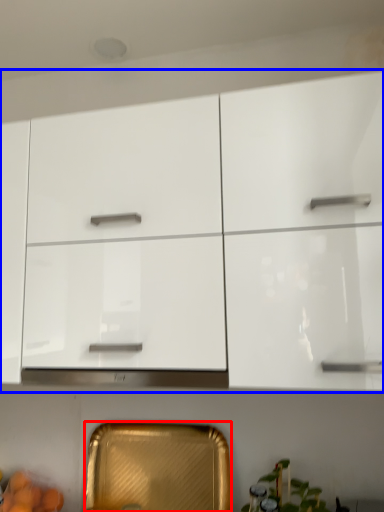
Question: Which object is further to the camera taking this photo, cabinetry (highlighted by a red box) or cabinetry (highlighted by a blue box)?

Choices:
 (A) cabinetry
 (B) cabinetry

Answer: (A)